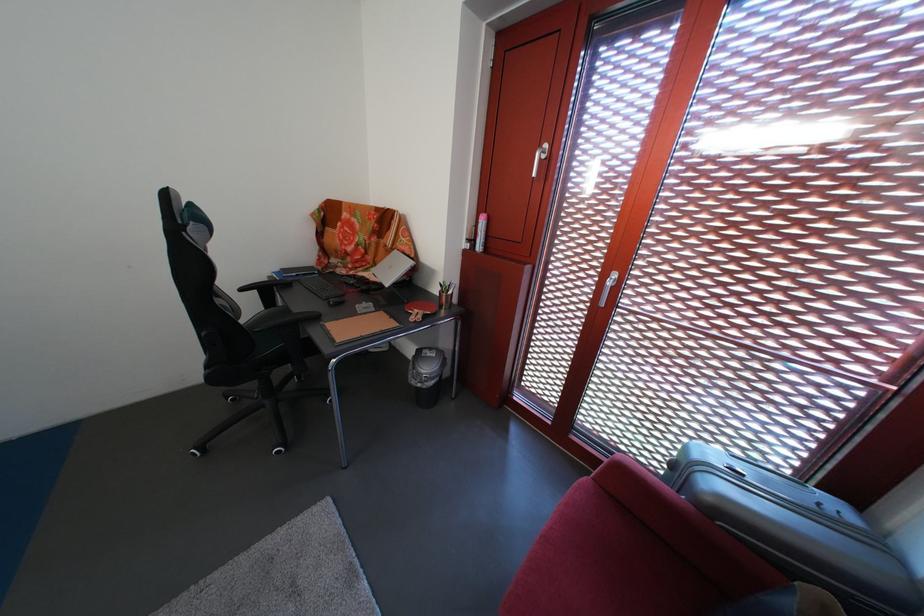
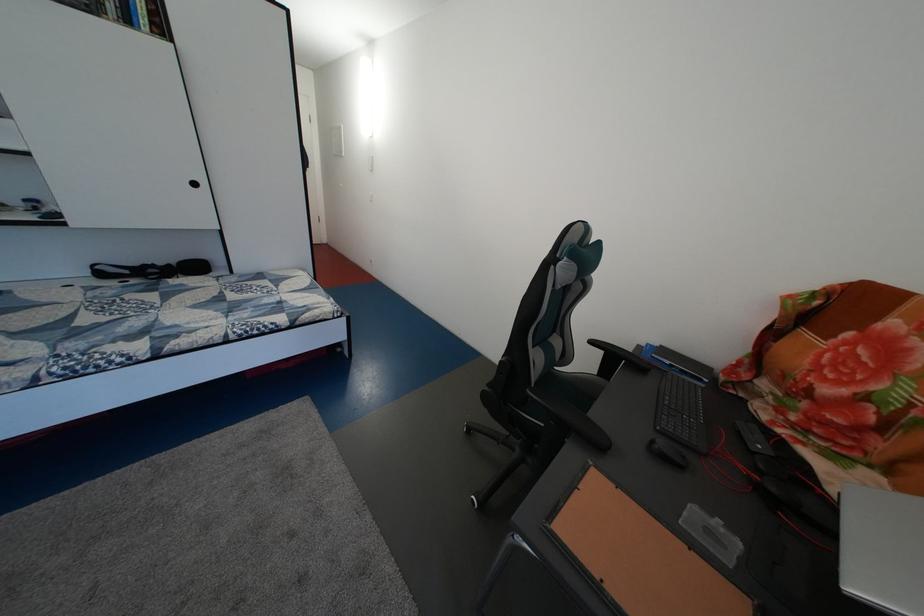
Based on the continuous images, in which direction is the camera rotating?

The rotation direction of the camera is left-down.